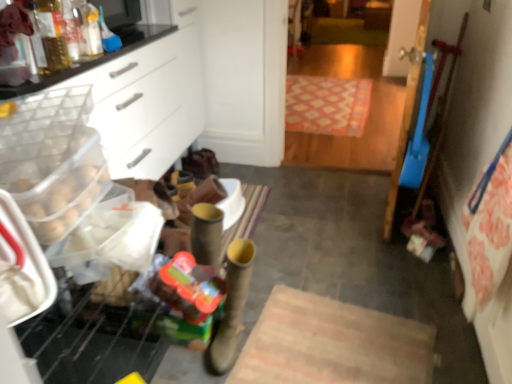
Question: Does translucent plastic bottle at upper left lie in front of white plastic drawer at left?

Choices:
 (A) no
 (B) yes

Answer: (A)

Question: Considering the relative sizes of translucent plastic bottle at upper left and white plastic drawer at left in the image provided, is translucent plastic bottle at upper left smaller than white plastic drawer at left?

Choices:
 (A) yes
 (B) no

Answer: (A)

Question: Is translucent plastic bottle at upper left far from white plastic drawer at left?

Choices:
 (A) yes
 (B) no

Answer: (B)

Question: Does translucent plastic bottle at upper left have a lesser height compared to white plastic drawer at left?

Choices:
 (A) yes
 (B) no

Answer: (A)

Question: Is translucent plastic bottle at upper left further to the viewer compared to white plastic drawer at left?

Choices:
 (A) no
 (B) yes

Answer: (B)

Question: Looking at their shapes, would you say patterned carpet at center is wider or thinner than white plastic drawer at left?

Choices:
 (A) wide
 (B) thin

Answer: (A)

Question: Is point (315, 92) closer or farther from the camera than point (267, 23)?

Choices:
 (A) closer
 (B) farther

Answer: (B)

Question: In the image, is patterned carpet at center positioned in front of or behind white plastic drawer at left?

Choices:
 (A) front
 (B) behind

Answer: (B)

Question: From a real-world perspective, relative to white plastic drawer at left, is patterned carpet at center vertically above or below?

Choices:
 (A) below
 (B) above

Answer: (A)

Question: From the image's perspective, is translucent plastic toy at lower left above or below white plastic drawer at left?

Choices:
 (A) below
 (B) above

Answer: (A)

Question: Would you say translucent plastic toy at lower left is inside or outside white plastic drawer at left?

Choices:
 (A) inside
 (B) outside

Answer: (B)

Question: Looking at their shapes, would you say translucent plastic toy at lower left is wider or thinner than white plastic drawer at left?

Choices:
 (A) wide
 (B) thin

Answer: (B)

Question: From their relative heights in the image, would you say translucent plastic toy at lower left is taller or shorter than white plastic drawer at left?

Choices:
 (A) short
 (B) tall

Answer: (A)

Question: Is leather boot at center taller or shorter than white plastic drawer at left?

Choices:
 (A) tall
 (B) short

Answer: (B)

Question: Considering the positions of point (225, 301) and point (132, 150), is point (225, 301) closer or farther from the camera than point (132, 150)?

Choices:
 (A) farther
 (B) closer

Answer: (B)